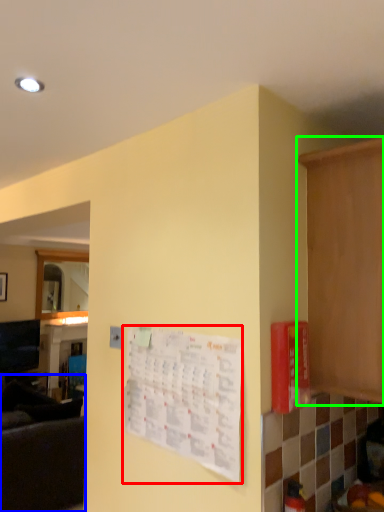
Question: Considering the real-world distances, which object is closest to bulletin board (highlighted by a red box)? couch (highlighted by a blue box) or cabinetry (highlighted by a green box).

Choices:
 (A) couch
 (B) cabinetry

Answer: (B)